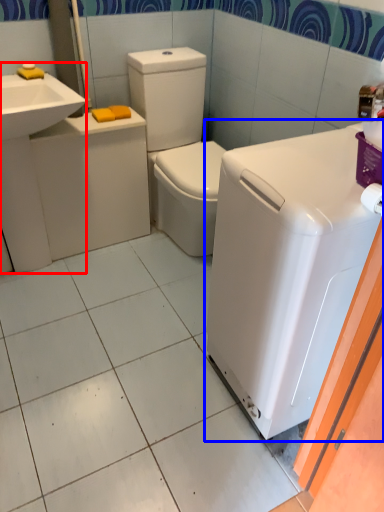
Question: Which object appears closest to the camera in this image, sink (highlighted by a red box) or washing machine (highlighted by a blue box)?

Choices:
 (A) sink
 (B) washing machine

Answer: (B)